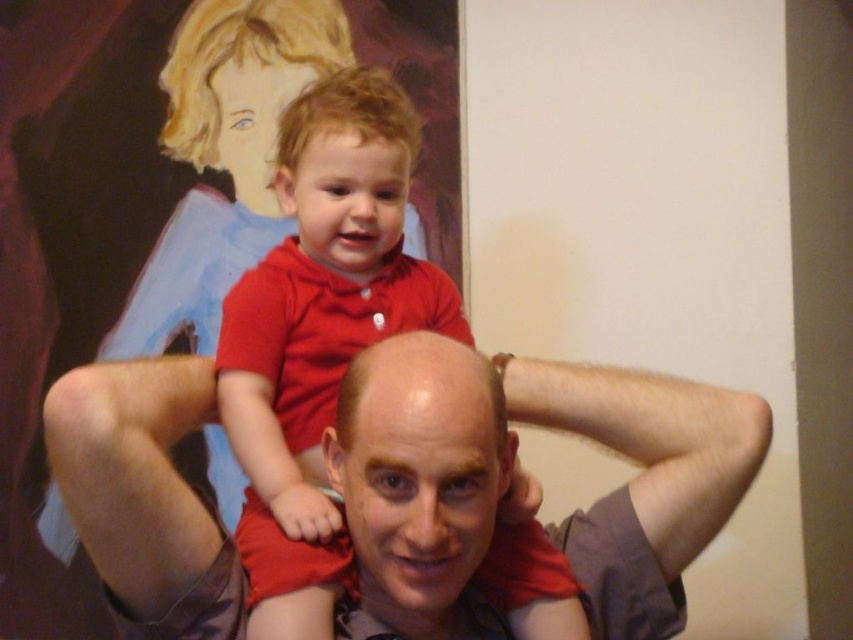
Which is in front, point (181, 426) or point (485, 362)?

Positioned in front is point (485, 362).

Measure the distance between smooth gray shirt at center and smooth bald head at center.

They are 2.92 inches apart.

Locate an element on the screen. This screenshot has height=640, width=853. smooth gray shirt at center is located at coordinates (643, 481).

Is smooth bald head at center below matte red shirt at center?

Indeed, smooth bald head at center is positioned under matte red shirt at center.

Does smooth bald head at center appear on the left side of matte red shirt at center?

No, smooth bald head at center is not to the left of matte red shirt at center.

Which is in front, point (360, 552) or point (282, 138)?

Point (360, 552)

This screenshot has height=640, width=853. Find the location of `smooth bald head at center`. smooth bald head at center is located at coordinates (418, 468).

Is smooth gray shirt at center wider than matte red shirt at center?

Correct, the width of smooth gray shirt at center exceeds that of matte red shirt at center.

Which is in front, point (759, 435) or point (401, 179)?

Positioned in front is point (759, 435).

The image size is (853, 640). I want to click on smooth gray shirt at center, so click(x=643, y=481).